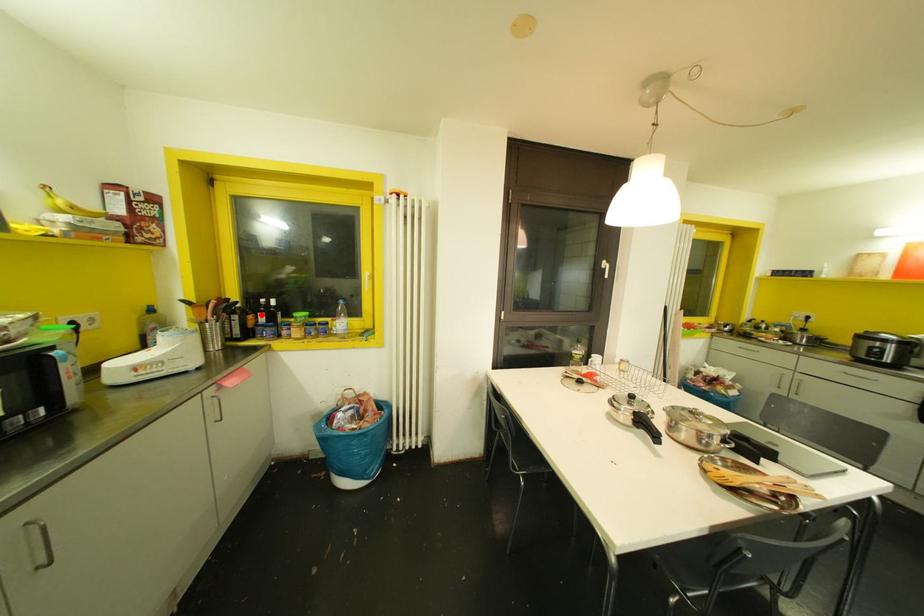
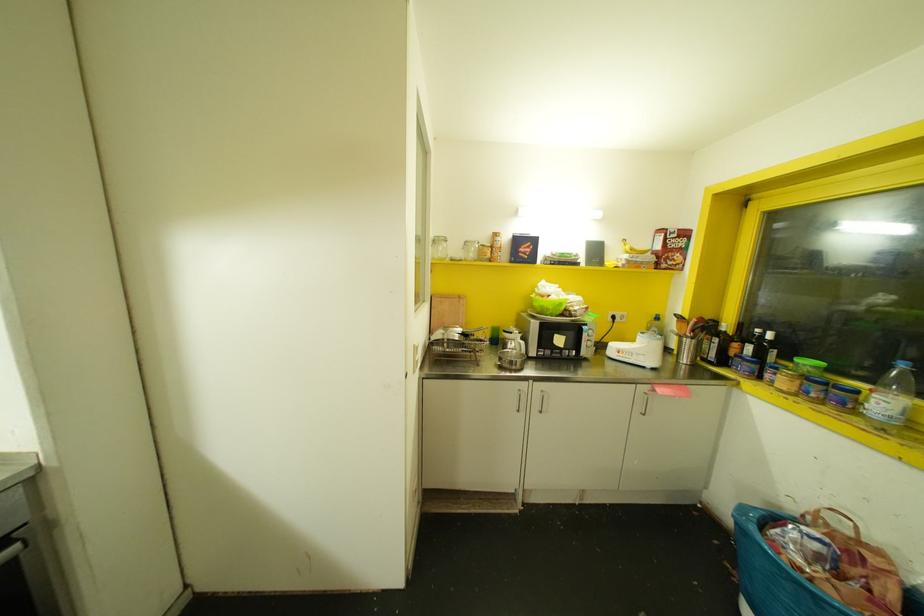
Where in the second image is the point corresponding to the highlighted location from the first image?

(748, 347)